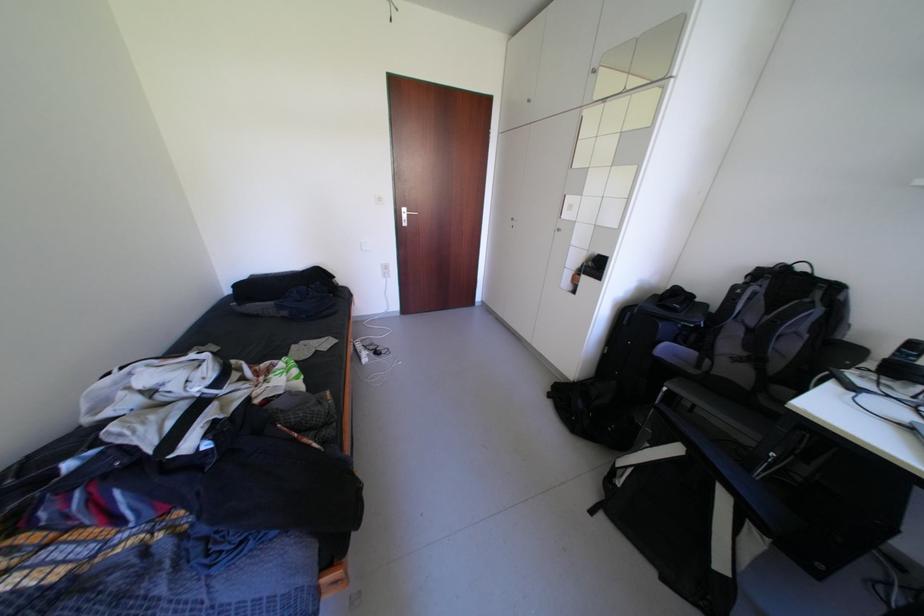
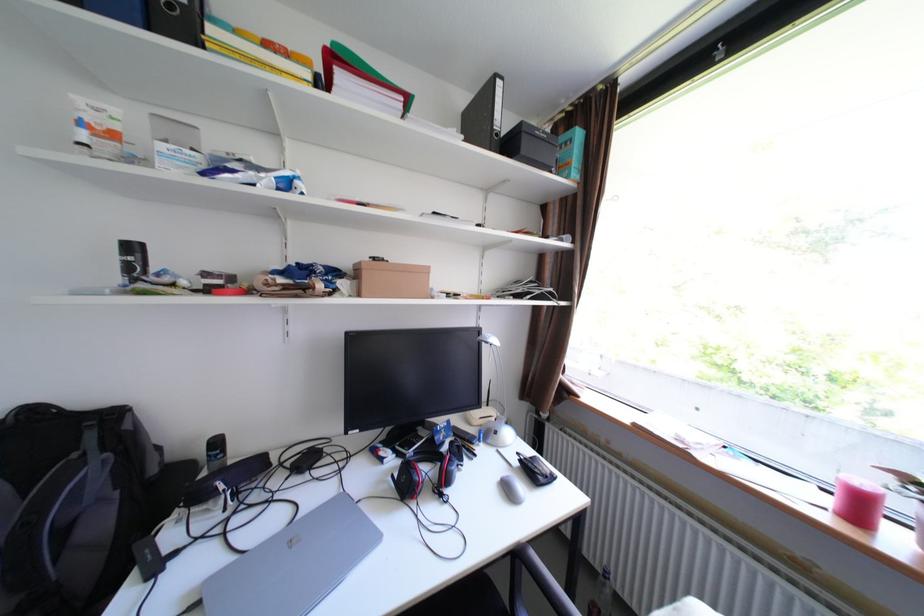
Find the pixel in the second image that matches pixel 799 346 in the first image.

(110, 524)